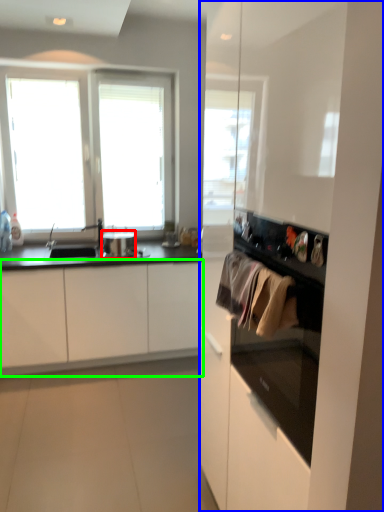
Question: Which object is the farthest from appliance (highlighted by a red box)? Choose among these: dresser (highlighted by a blue box) or cabinetry (highlighted by a green box).

Choices:
 (A) dresser
 (B) cabinetry

Answer: (A)